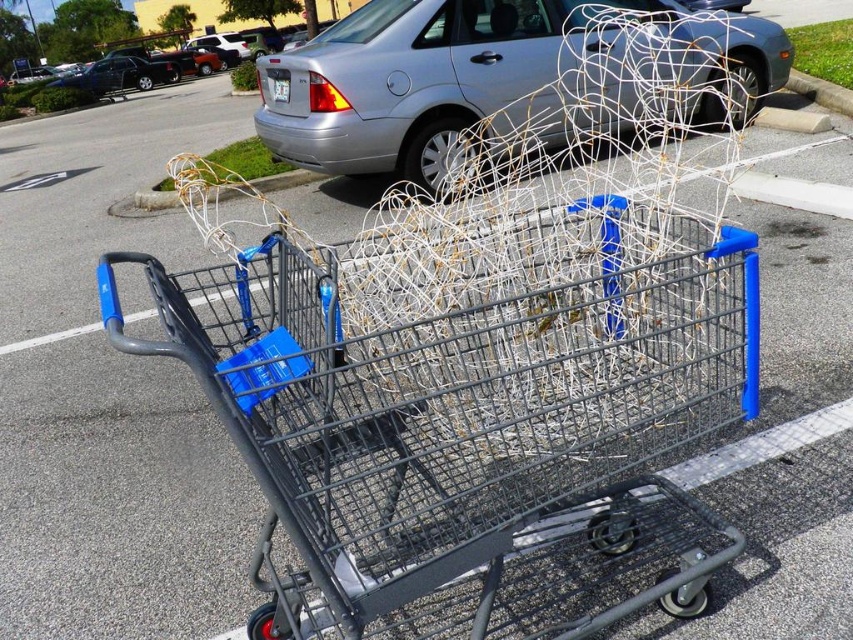
Consider the image. Can you confirm if silver metallic car at center is positioned below silver metallic sedan at center?

Yes.

Where is `silver metallic car at center`? silver metallic car at center is located at coordinates (503, 77).

Locate an element on the screen. This screenshot has width=853, height=640. silver metallic car at center is located at coordinates (503, 77).

Which is in front, point (445, 497) or point (659, 45)?

Point (445, 497) is more forward.

Who is more distant from viewer, (235, 259) or (357, 68)?

Point (357, 68)

Is point (492, 460) positioned after point (662, 45)?

That is False.

The image size is (853, 640). In order to click on metallic gray shopping cart at center in this screenshot , I will do `click(473, 413)`.

The width and height of the screenshot is (853, 640). Describe the element at coordinates (473, 413) in the screenshot. I see `metallic gray shopping cart at center` at that location.

Is metallic gray shopping cart at center below silver metallic sedan at center?

Yes, metallic gray shopping cart at center is below silver metallic sedan at center.

Is point (148, 346) in front of point (22, 97)?

Yes, point (148, 346) is in front of point (22, 97).

Locate an element on the screen. The height and width of the screenshot is (640, 853). metallic gray shopping cart at center is located at coordinates (473, 413).